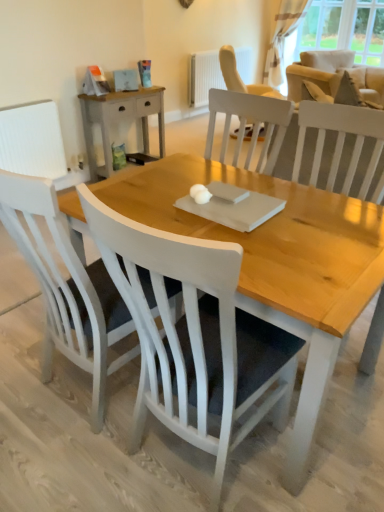
Question: Looking at their shapes, would you say light wood/rough surface nightstand at upper left is wider or thinner than transparent curtain at upper right?

Choices:
 (A) thin
 (B) wide

Answer: (B)

Question: Would you say light wood/rough surface nightstand at upper left is to the left or to the right of transparent curtain at upper right in the picture?

Choices:
 (A) right
 (B) left

Answer: (B)

Question: Estimate the real-world distances between objects in this image. Which object is closer to the white wood chair at center, which is the second chair from left to right?

Choices:
 (A) white matte chair at lower left, arranged as the 1th chair when viewed from the left
 (B) white wood chair at upper right, the 3th chair when ordered from left to right
 (C) white textured radiator at upper center
 (D) white textured curtain at upper right
 (E) beige fabric armchair at upper right

Answer: (A)

Question: Which is nearer to the white wood chair at upper right, which is the third chair in front-to-back order?

Choices:
 (A) beige fabric armchair at upper right
 (B) white textured radiator at upper center
 (C) white matte chair at lower left, which is counted as the 2th chair, starting from the back
 (D) transparent curtain at upper right
 (E) light wood/rough surface nightstand at upper left

Answer: (C)